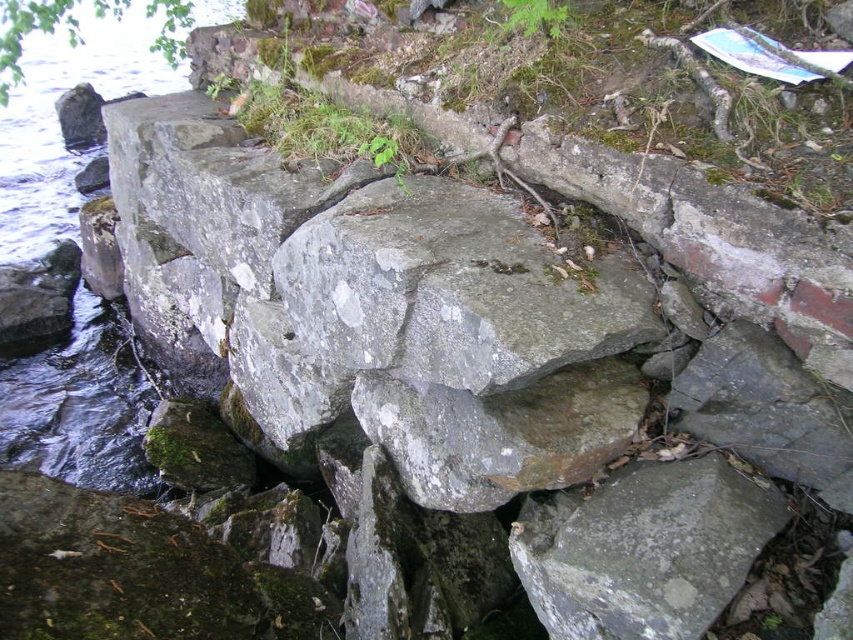
You are a hiker who wants to cross the gray rough rock at center. There is a gray stone creek at left nearby. Which object is higher in elevation?

The gray stone creek at left is above the gray rough rock at center, so the gray stone creek at left is higher in elevation.

You are standing on the rocky shoreline and want to cross to the other side. The gray stone creek at left is in your path. Can you step over it without getting your feet wet?

The gray stone creek at left is 4.25 meters away from you, so you can safely step over it without getting your feet wet.